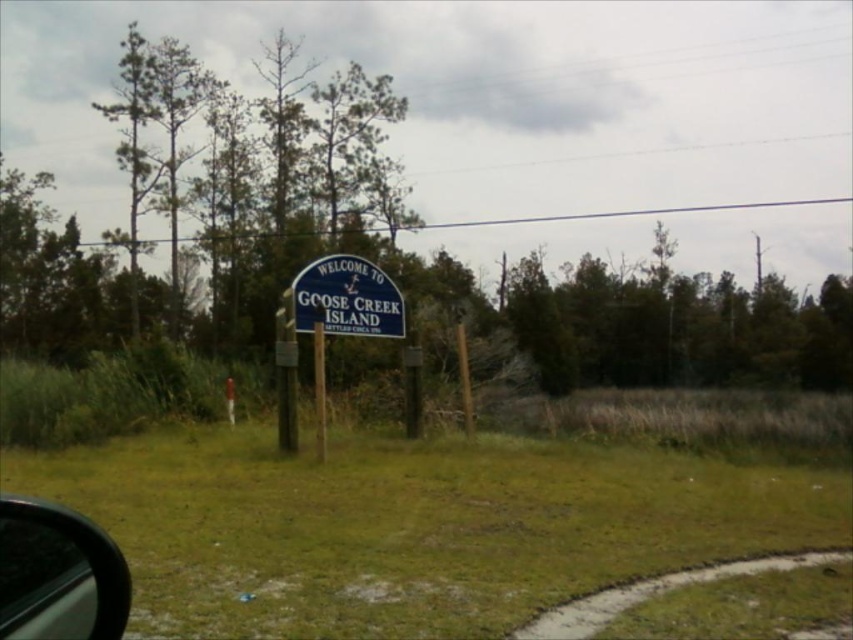
Question: Which point is farther to the camera?

Choices:
 (A) transparent glass car window at lower left
 (B) wooden post at center
 (C) blue painted wood sign at center

Answer: (C)

Question: Which point is farther to the camera?

Choices:
 (A) (67, 637)
 (B) (326, 332)

Answer: (B)

Question: In this image, where is blue painted wood sign at center located relative to wooden post at center?

Choices:
 (A) left
 (B) right

Answer: (B)

Question: Which point is closer to the camera taking this photo?

Choices:
 (A) (323, 444)
 (B) (68, 618)
 (C) (387, 291)

Answer: (B)

Question: Considering the relative positions of transparent glass car window at lower left and blue painted wood sign at center in the image provided, where is transparent glass car window at lower left located with respect to blue painted wood sign at center?

Choices:
 (A) right
 (B) left

Answer: (A)

Question: In this image, where is transparent glass car window at lower left located relative to blue painted wood sign at center?

Choices:
 (A) below
 (B) above

Answer: (A)